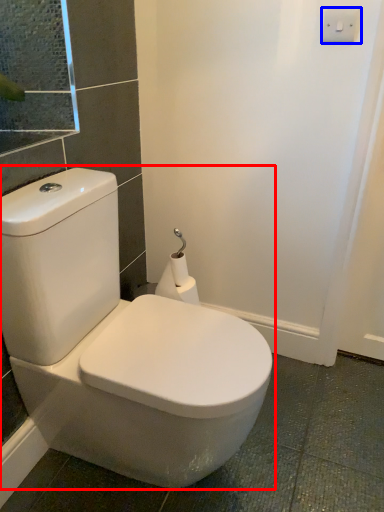
Question: Among these objects, which one is farthest to the camera, toilet (highlighted by a red box) or light switch (highlighted by a blue box)?

Choices:
 (A) toilet
 (B) light switch

Answer: (B)